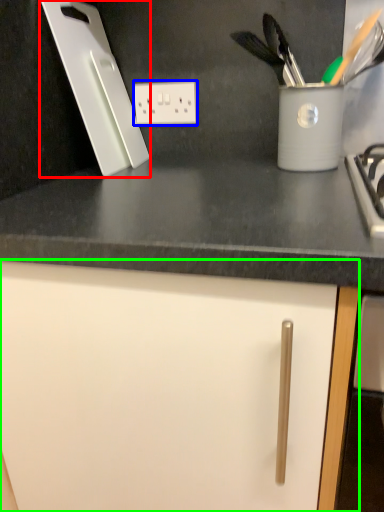
Question: Which object is the farthest from kitchen appliance (highlighted by a red box)? Choose among these: electric outlet (highlighted by a blue box) or cabinetry (highlighted by a green box).

Choices:
 (A) electric outlet
 (B) cabinetry

Answer: (B)